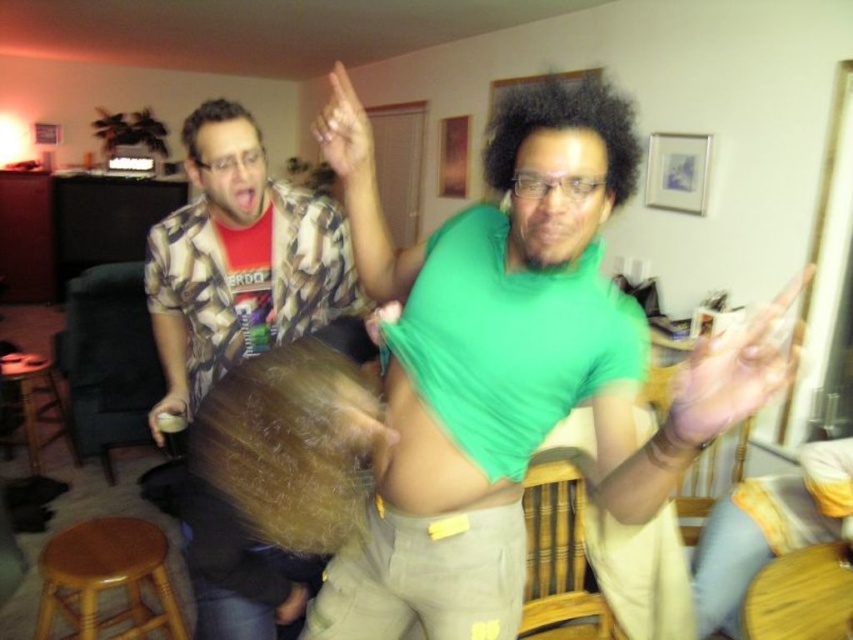
You are a guest at the party and want to grab a drink from the snack table. You need to pass between the translucent plastic hand at upper right and the wooden bar stool at lower left. Can you walk through the space between them?

The translucent plastic hand at upper right is thinner than the wooden bar stool at lower left, so the space between them is narrow. However, since the hand is translucent and likely part of a decorative item or prop, you can easily walk around or through the area without obstruction from the wooden bar stool at lower left.

You are taking a photo of the two people in the scene. The first person is at point (264, 234) and the second person is at point (9, 365). Which person will appear larger in your photo?

The person at point (264, 234) will appear larger in the photo because they are closer to the camera than the person at point (9, 365).